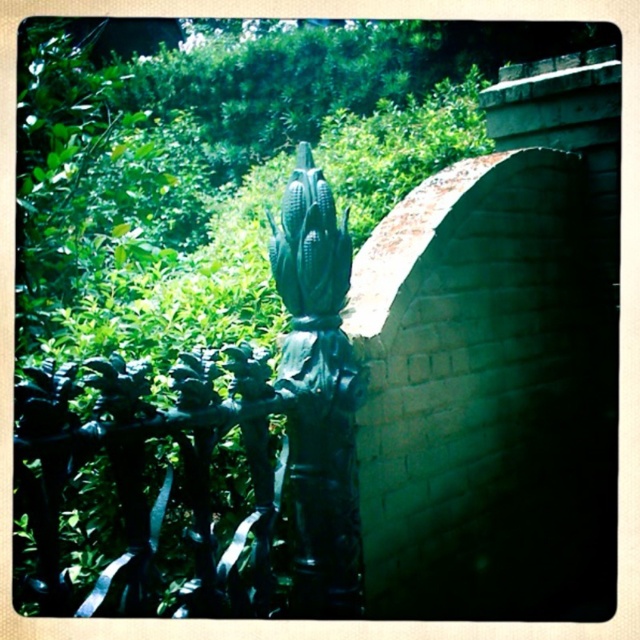
Does dark green wrought iron at left come in front of green matte corn cob at center?

Yes.

What are the coordinates of `dark green wrought iron at left` in the screenshot? It's located at (141, 470).